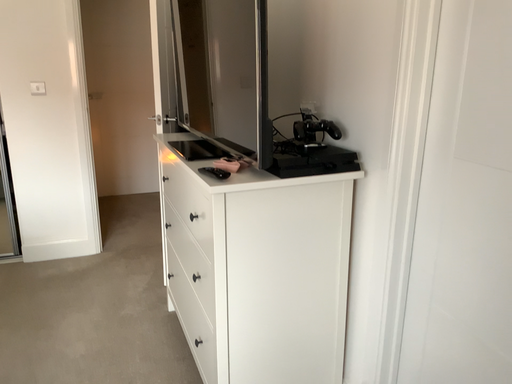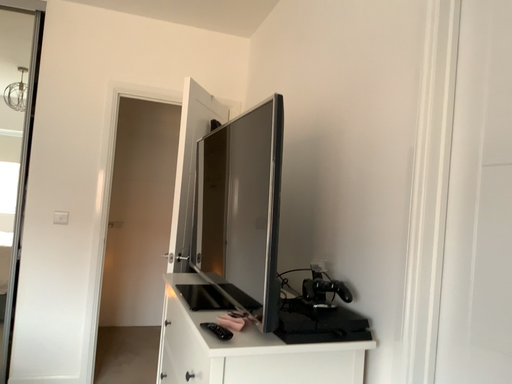
Question: How did the camera likely rotate when shooting the video?

Choices:
 (A) rotated upward
 (B) rotated downward

Answer: (A)